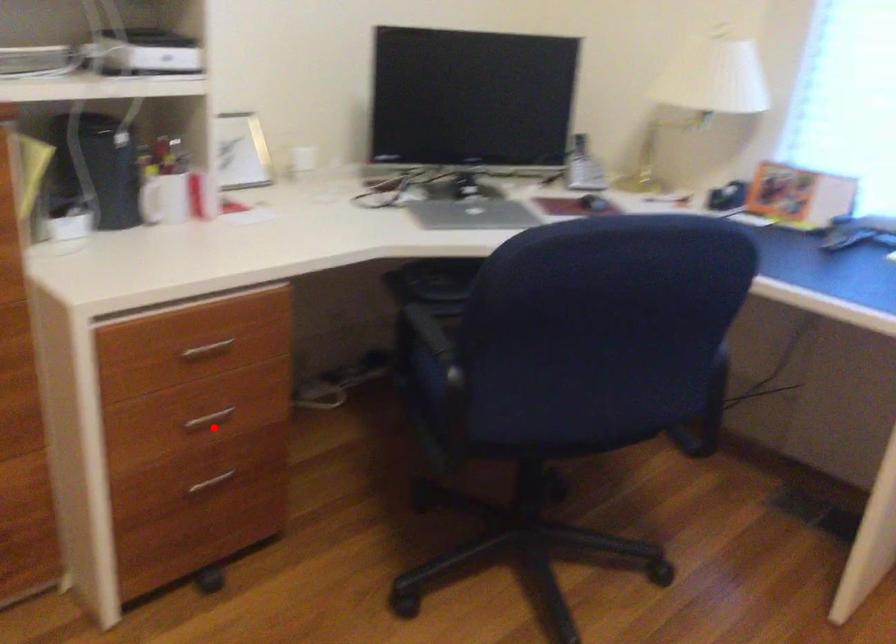
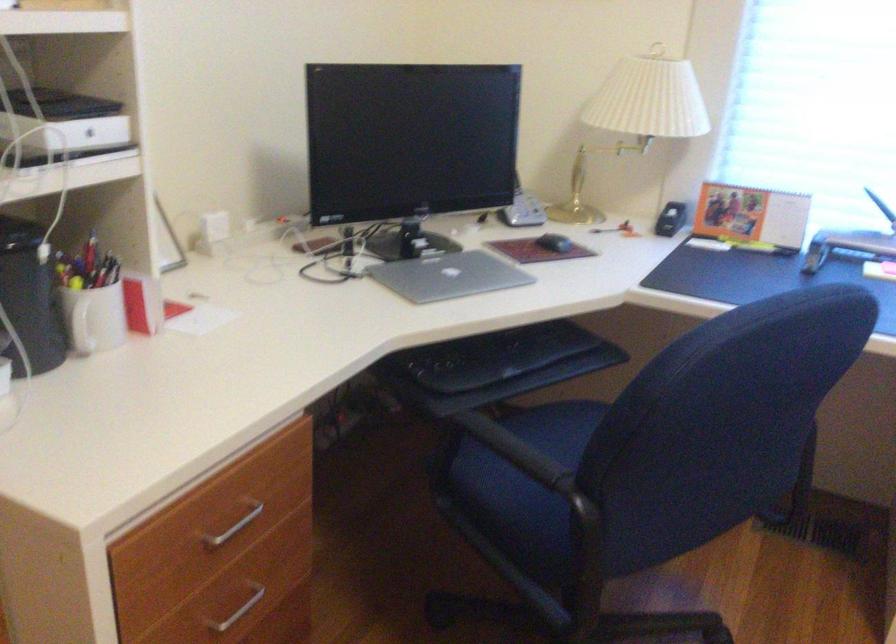
Question: A red point is marked in image1. In image2, is the corresponding 3D point closer to the camera or farther? Reply with the corresponding letter.

Choices:
 (A) The corresponding 3D point is closer.
 (B) The corresponding 3D point is farther.

Answer: (A)